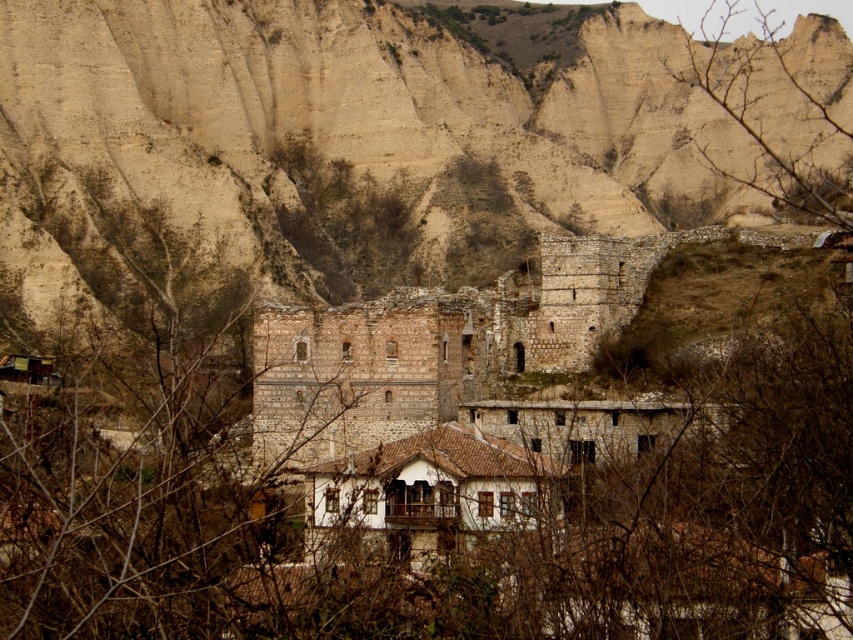
Question: Which point is farther to the camera?

Choices:
 (A) bare branches at upper right
 (B) beige stone wall at center

Answer: (B)

Question: Does beige stone wall at center have a larger size compared to bare branches at upper right?

Choices:
 (A) no
 (B) yes

Answer: (B)

Question: Among these points, which one is nearest to the camera?

Choices:
 (A) (751, 97)
 (B) (670, 33)

Answer: (A)

Question: Observing the image, what is the correct spatial positioning of beige stone wall at center in reference to bare branches at upper right?

Choices:
 (A) above
 (B) below

Answer: (B)

Question: Is beige stone wall at center above bare branches at upper right?

Choices:
 (A) no
 (B) yes

Answer: (A)